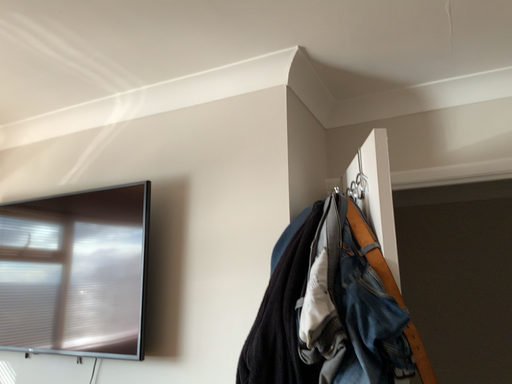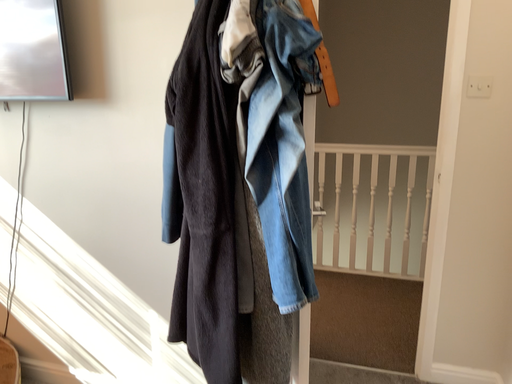
Question: Which way did the camera rotate in the video?

Choices:
 (A) rotated right
 (B) rotated left

Answer: (A)